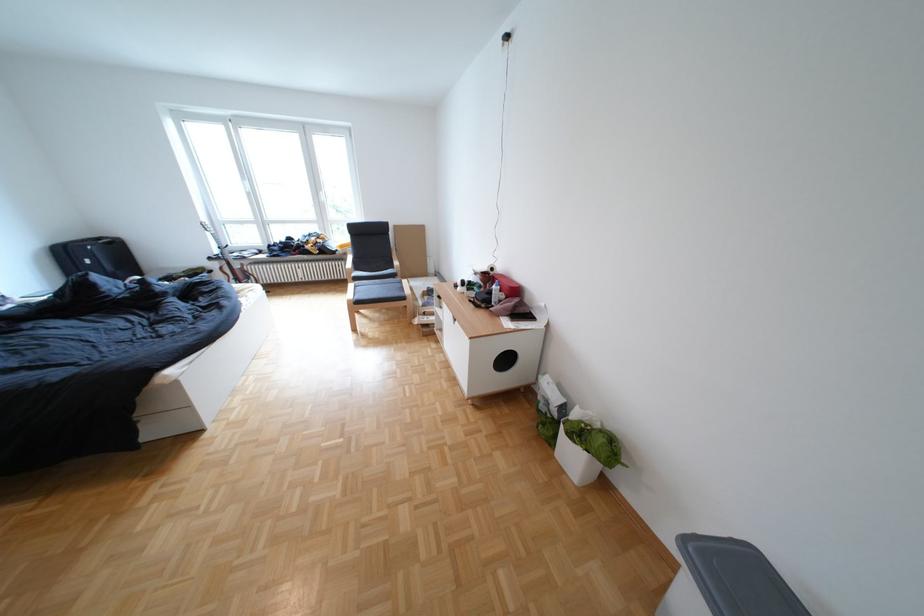
What do you see at coordinates (99, 245) in the screenshot? The width and height of the screenshot is (924, 616). I see `the black suitcase handle` at bounding box center [99, 245].